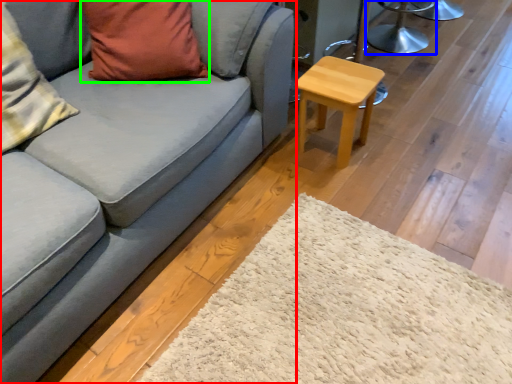
Question: Considering the real-world distances, which object is closest to studio couch (highlighted by a red box)? swivel chair (highlighted by a blue box) or pillow (highlighted by a green box).

Choices:
 (A) swivel chair
 (B) pillow

Answer: (B)